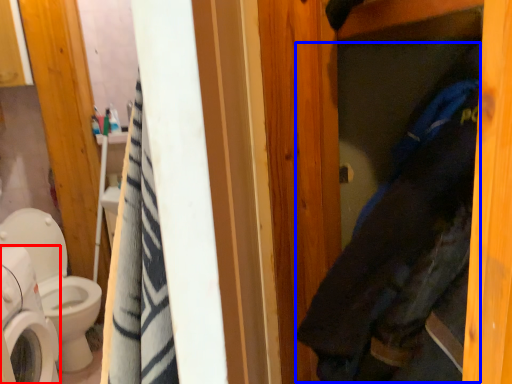
Question: Which point is further to the camera, washing machine (highlighted by a red box) or clothing (highlighted by a blue box)?

Choices:
 (A) washing machine
 (B) clothing

Answer: (A)